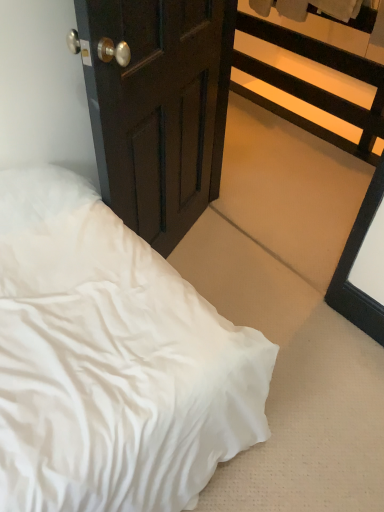
Question: Can you confirm if white satin bed at lower left is bigger than black wood balustrade at upper right?

Choices:
 (A) yes
 (B) no

Answer: (B)

Question: Is white satin bed at lower left to the left of black wood balustrade at upper right from the viewer's perspective?

Choices:
 (A) yes
 (B) no

Answer: (A)

Question: From the image's perspective, is white satin bed at lower left under black wood balustrade at upper right?

Choices:
 (A) yes
 (B) no

Answer: (A)

Question: Does white satin bed at lower left have a lesser height compared to black wood balustrade at upper right?

Choices:
 (A) yes
 (B) no

Answer: (A)

Question: Can you confirm if white satin bed at lower left is thinner than black wood balustrade at upper right?

Choices:
 (A) no
 (B) yes

Answer: (A)

Question: From the image's perspective, is white satin bed at lower left above black wood balustrade at upper right?

Choices:
 (A) yes
 (B) no

Answer: (B)

Question: Is dark wood door at center to the right of white satin bed at lower left from the viewer's perspective?

Choices:
 (A) yes
 (B) no

Answer: (B)

Question: From a real-world perspective, is dark wood door at center under white satin bed at lower left?

Choices:
 (A) no
 (B) yes

Answer: (A)

Question: Is dark wood door at center placed right next to white satin bed at lower left?

Choices:
 (A) yes
 (B) no

Answer: (B)

Question: Does dark wood door at center have a larger size compared to white satin bed at lower left?

Choices:
 (A) yes
 (B) no

Answer: (A)

Question: Is white satin bed at lower left inside dark wood door at center?

Choices:
 (A) yes
 (B) no

Answer: (B)

Question: Is dark wood door at center at the left side of white satin bed at lower left?

Choices:
 (A) yes
 (B) no

Answer: (A)

Question: From a real-world perspective, is dark wood door at center positioned under black wood balustrade at upper right based on gravity?

Choices:
 (A) no
 (B) yes

Answer: (A)